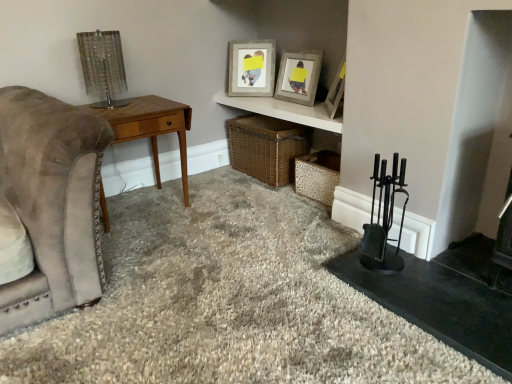
Locate an element on the screen. The image size is (512, 384). free space in front of wooden desk at left is located at coordinates (147, 251).